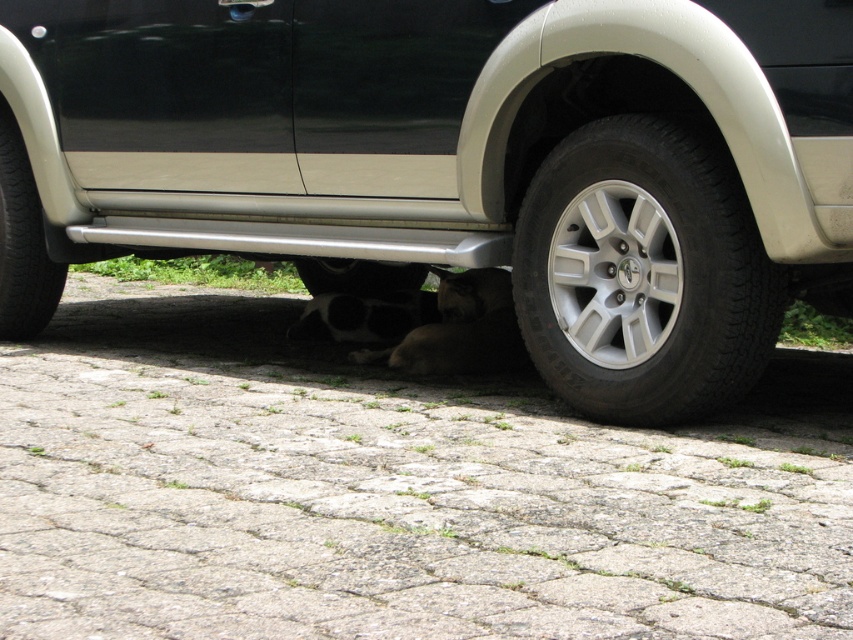
Does point (653, 310) come closer to viewer compared to point (57, 289)?

That is True.

Can you confirm if silver metallic wheel at lower right is bigger than black rubber tire at lower left?

Correct, silver metallic wheel at lower right is larger in size than black rubber tire at lower left.

Where is `silver metallic wheel at lower right`? This screenshot has height=640, width=853. silver metallic wheel at lower right is located at coordinates (642, 275).

Who is positioned more to the right, black matte car at lower center or black rubber tire at lower center?

black matte car at lower center

Which is behind, point (614, 124) or point (337, 291)?

Positioned behind is point (337, 291).

Which is behind, point (770, 250) or point (338, 264)?

The point (338, 264) is behind.

Where is `black matte car at lower center`? Image resolution: width=853 pixels, height=640 pixels. black matte car at lower center is located at coordinates (471, 160).

Can you confirm if silver metallic wheel at lower right is positioned below black rubber tire at lower center?

Correct, silver metallic wheel at lower right is located below black rubber tire at lower center.

Is silver metallic wheel at lower right shorter than black rubber tire at lower center?

No, silver metallic wheel at lower right is not shorter than black rubber tire at lower center.

In order to click on silver metallic wheel at lower right in this screenshot , I will do [x=642, y=275].